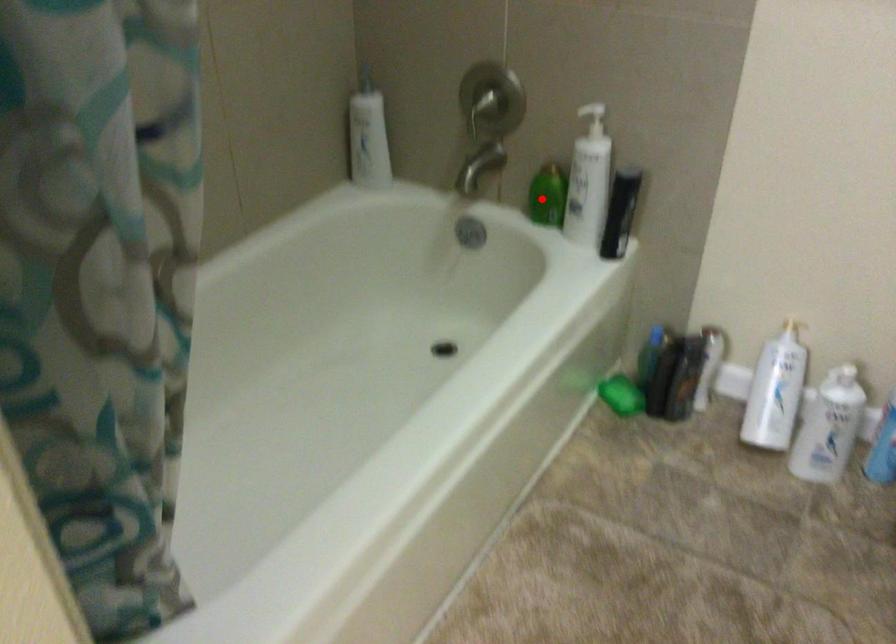
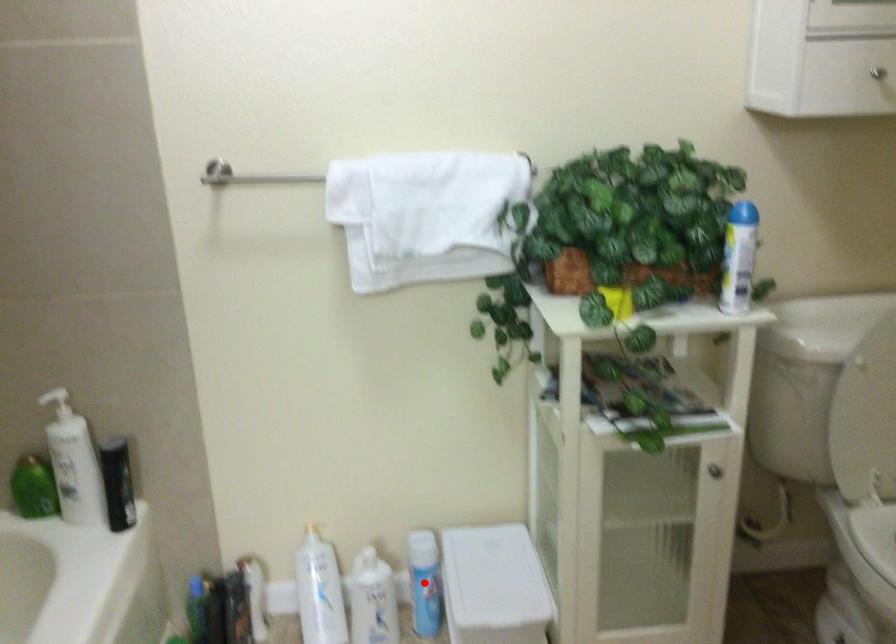
I am providing you with two images of the same scene from different viewpoints. A red point is marked on the first image and another point is marked on the second image. Is the red point in image1 aligned with the point shown in image2?

No